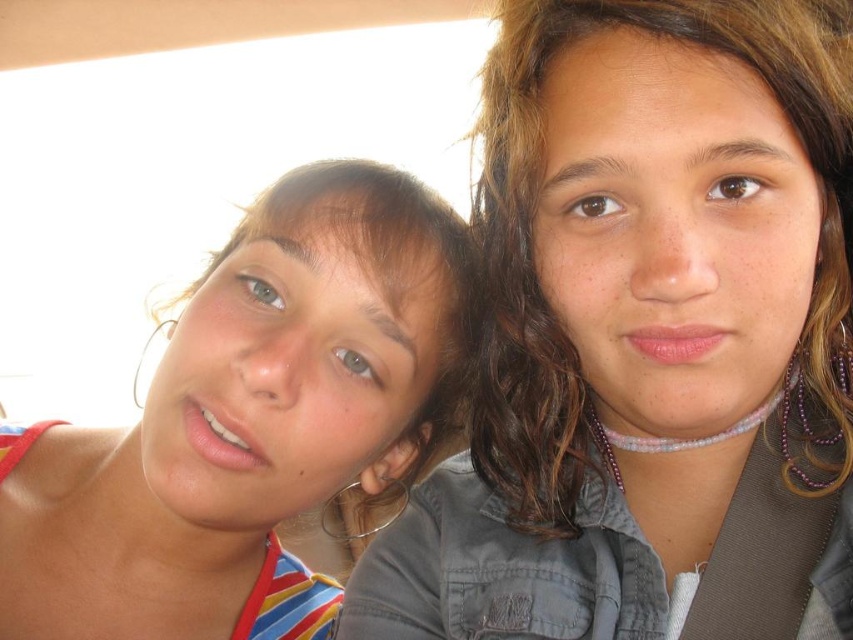
Does matte gray shirt at upper right come in front of matte striped tank top at left?

Yes.

Between point (547, 516) and point (175, 611), which one is positioned in front?

Point (547, 516) is in front.

The height and width of the screenshot is (640, 853). In order to click on matte gray shirt at upper right in this screenshot , I will do `click(648, 339)`.